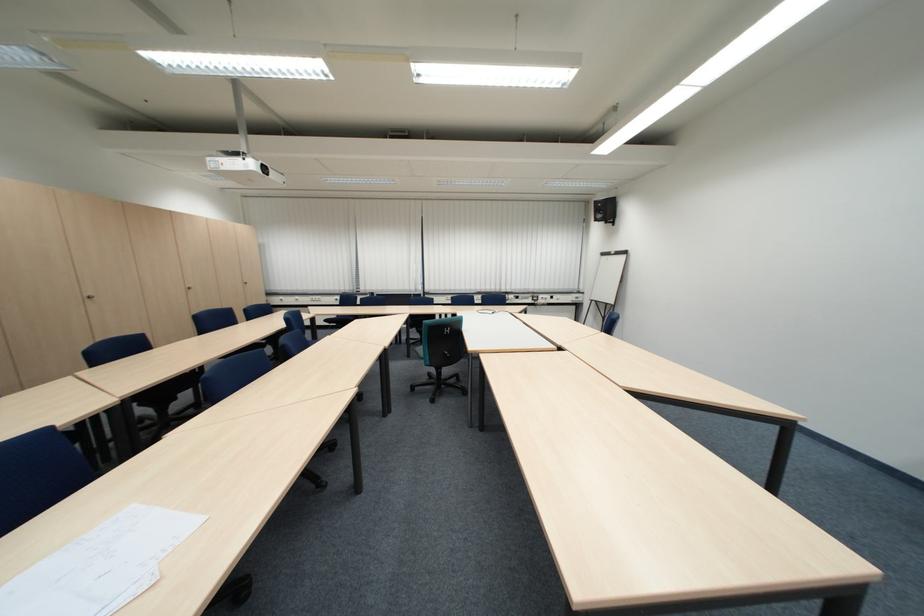
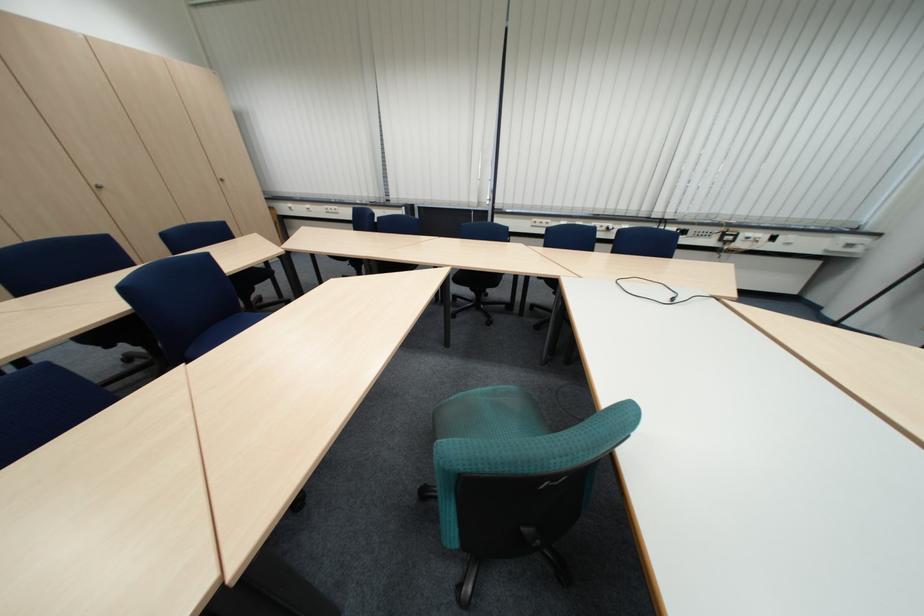
Find the pixel in the second image that matches the point at 553,297 in the first image.

(759, 235)